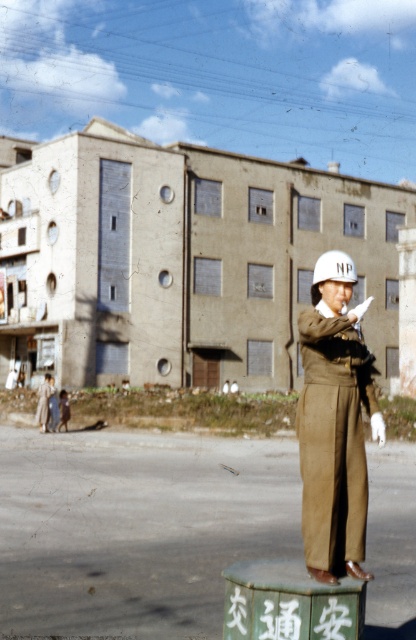
Is point (314, 384) in front of point (331, 266)?

That is False.

The image size is (416, 640). Describe the element at coordinates (334, 422) in the screenshot. I see `matte khaki uniform at center` at that location.

I want to click on matte khaki uniform at center, so click(x=334, y=422).